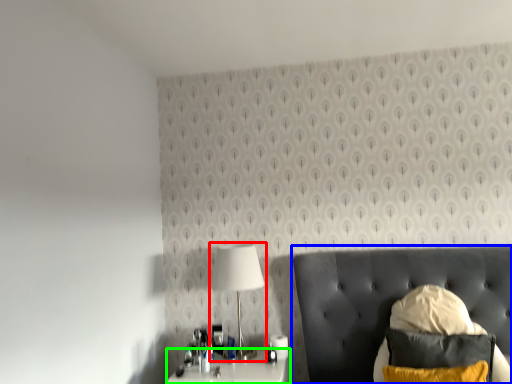
Question: Considering the real-world distances, which object is closest to lamp (highlighted by a red box)? furniture (highlighted by a blue box) or nightstand (highlighted by a green box).

Choices:
 (A) furniture
 (B) nightstand

Answer: (B)